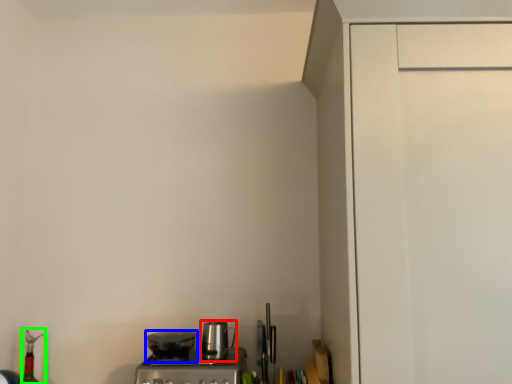
Question: Considering the real-world distances, which object is closest to kitchen appliance (highlighted by a red box)? kitchen appliance (highlighted by a blue box) or bottle (highlighted by a green box).

Choices:
 (A) kitchen appliance
 (B) bottle

Answer: (A)